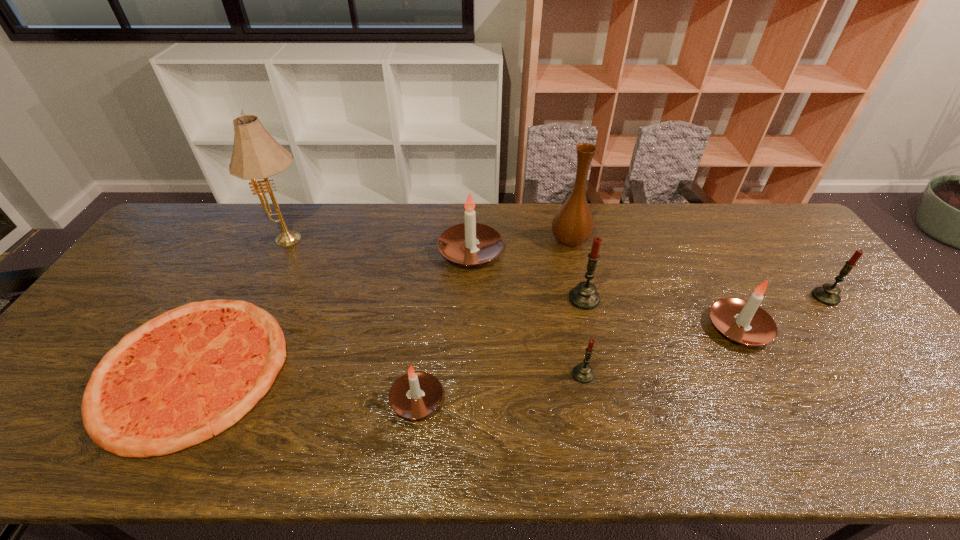
Locate an element on the screen. This screenshot has height=540, width=960. vacant space that is in between the smallest red candle and the second smallest red candle is located at coordinates (705, 335).

The image size is (960, 540). Identify the location of vacant region between the biggest white candle and the nearest red candle. (527, 313).

Where is `vacant space that's between the rightmost white candle and the vase`? vacant space that's between the rightmost white candle and the vase is located at coordinates (654, 285).

Identify the location of empty location between the second candle from right to left and the farthest candle. This screenshot has height=540, width=960. (605, 290).

Locate an element on the screen. The image size is (960, 540). vacant space that is in between the rightmost candle and the smallest white candle is located at coordinates (621, 348).

The height and width of the screenshot is (540, 960). In order to click on vacant space in between the smallest red candle and the tallest object in this screenshot , I will do `click(437, 308)`.

Where is `object that can be found as the seventh closest to the smallest white candle`? Image resolution: width=960 pixels, height=540 pixels. object that can be found as the seventh closest to the smallest white candle is located at coordinates (742, 321).

Locate an element on the screen. This screenshot has width=960, height=540. object that is the fifth nearest to the smallest white candle is located at coordinates (256, 154).

Identify which candle is located as the fourth nearest to the smallest red candle. Please provide its 2D coordinates. Your answer should be formatted as a tuple, i.e. [(x, y)], where the tuple contains the x and y coordinates of a point satisfying the conditions above.

[(458, 243)]

At what (x,y) coordinates should I click in order to perform the action: click on candle that is the second closest one to the smallest red candle. Please return your answer as a coordinate pair (x, y). The width and height of the screenshot is (960, 540). Looking at the image, I should click on tap(414, 395).